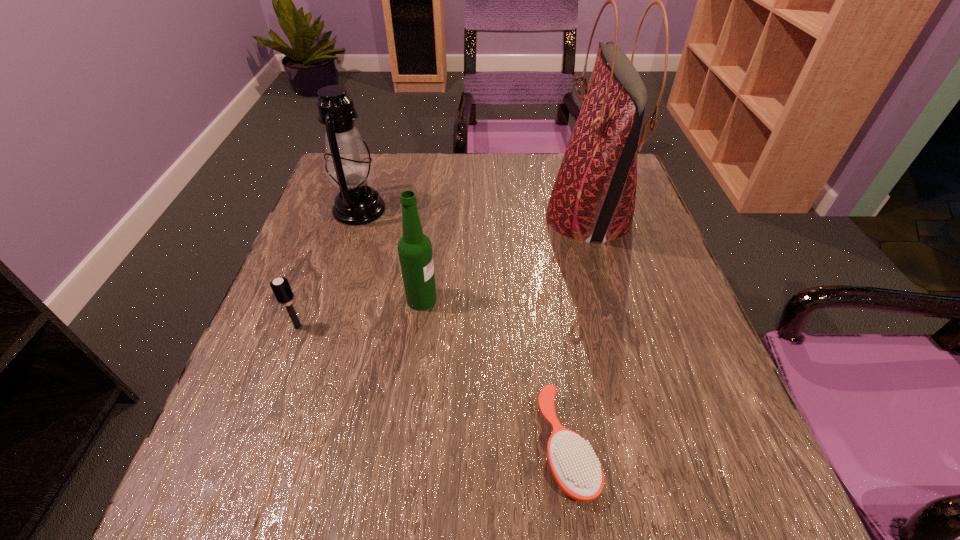
You are a GUI agent. You are given a task and a screenshot of the screen. Output one action in this format:
    pyautogui.click(x=<x>, y=<y>)
    Task: Click on the free space located on the label of the beer bottle
    This screenshot has height=540, width=960.
    Given the screenshot: What is the action you would take?
    pyautogui.click(x=588, y=300)

The height and width of the screenshot is (540, 960). I want to click on vacant area situated 0.320m on the right of the taller hairbrush, so click(476, 326).

Locate an element on the screen. The height and width of the screenshot is (540, 960). vacant space located 0.310m on the back of the nearer hairbrush is located at coordinates (541, 265).

Where is `handbag located at the far edge`? This screenshot has height=540, width=960. handbag located at the far edge is located at coordinates (593, 198).

Locate an element on the screen. This screenshot has width=960, height=540. oil lamp located in the far edge section of the desktop is located at coordinates (349, 167).

Identify the location of object located in the near edge section of the desktop. (573, 462).

Where is `oil lamp that is at the left edge`? The height and width of the screenshot is (540, 960). oil lamp that is at the left edge is located at coordinates (349, 167).

I want to click on hairbrush that is at the left edge, so click(281, 288).

Identify the location of object that is at the right edge. [593, 198].

You are a GUI agent. You are given a task and a screenshot of the screen. Output one action in this format:
    pyautogui.click(x=<x>, y=<y>)
    Task: Click on the object present at the far left corner
    The image size is (960, 540).
    Given the screenshot: What is the action you would take?
    pyautogui.click(x=349, y=167)